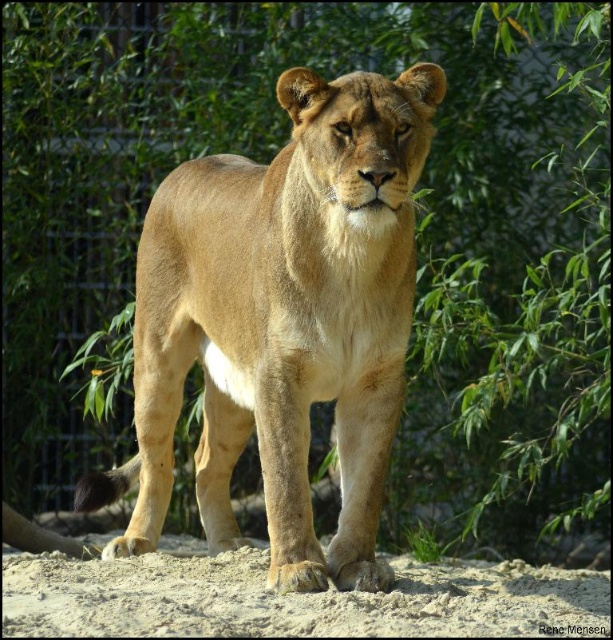
Does golden fur lion at center appear over light brown sandy ground at lower center?

Yes.

Who is positioned more to the left, golden fur lion at center or light brown sandy ground at lower center?

golden fur lion at center

Between point (162, 292) and point (109, 588), which one is positioned behind?

The point (162, 292) is more distant.

Identify the location of golden fur lion at center. This screenshot has height=640, width=613. (281, 321).